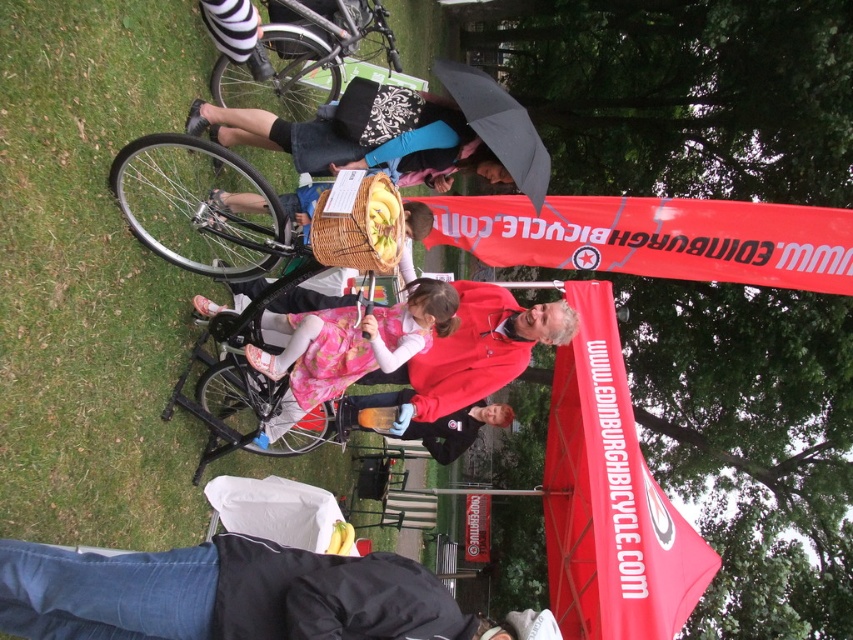
Which is behind, point (842, 244) or point (299, 326)?

The point (842, 244) is behind.

Is point (503, 237) in front of point (279, 317)?

That is False.

Between point (846, 216) and point (331, 362), which one is positioned behind?

Point (846, 216)

Find the location of a particular element. This screenshot has height=640, width=853. red fabric banner at upper center is located at coordinates (654, 237).

Can you confirm if red fabric canopy at center is wider than dark brown leather jacket at center?

Correct, the width of red fabric canopy at center exceeds that of dark brown leather jacket at center.

You are a GUI agent. You are given a task and a screenshot of the screen. Output one action in this format:
    pyautogui.click(x=<x>, y=<y>)
    Task: Click on the red fabric canopy at center
    This screenshot has width=853, height=640.
    Given the screenshot: What is the action you would take?
    pyautogui.click(x=608, y=497)

Locate an element on the screen. red fabric canopy at center is located at coordinates [608, 497].

Is point (566, 470) closer to viewer compared to point (321, 323)?

No.

Locate an element on the screen. This screenshot has height=640, width=853. red fabric canopy at center is located at coordinates (608, 497).